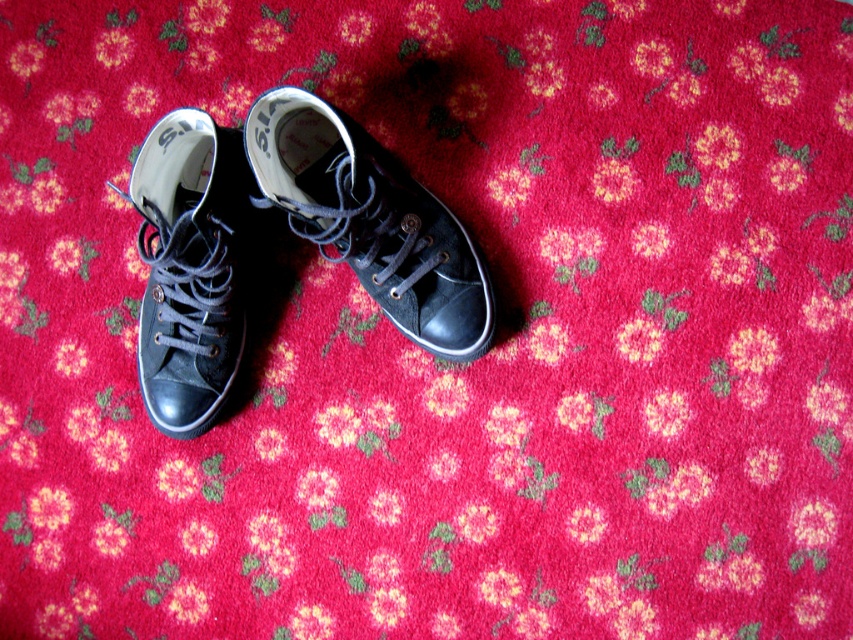
You are trying to measure the distance between the two matte black sneakers in the image. According to the scene, how far apart are the matte black sneaker at center and the matte black sneaker at left?

The matte black sneaker at center is 19.50 centimeters away from the matte black sneaker at left.